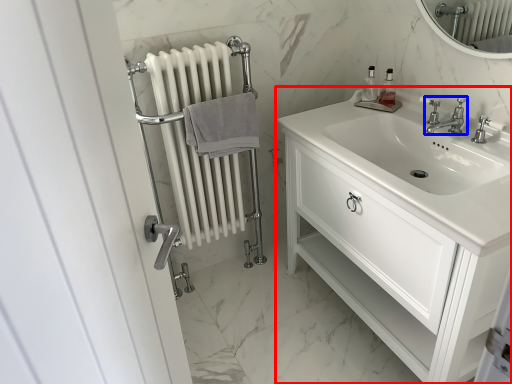
Question: Which of the following is the farthest to the observer, bathroom cabinet (highlighted by a red box) or tap (highlighted by a blue box)?

Choices:
 (A) bathroom cabinet
 (B) tap

Answer: (B)